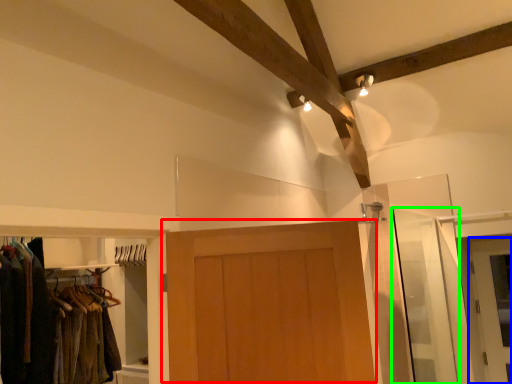
Question: Which object is the farthest from door (highlighted by a red box)? Choose among these: door (highlighted by a blue box) or screen door (highlighted by a green box).

Choices:
 (A) door
 (B) screen door

Answer: (A)